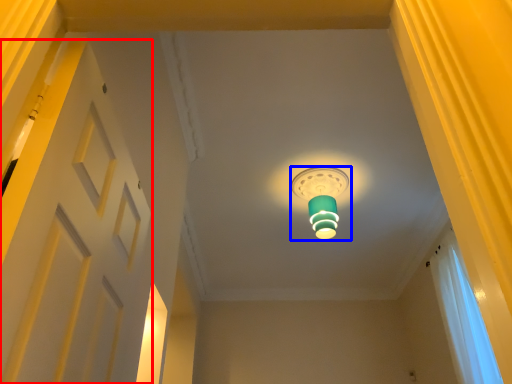
Question: Which point is further to the camera, door (highlighted by a red box) or lamp (highlighted by a blue box)?

Choices:
 (A) door
 (B) lamp

Answer: (B)